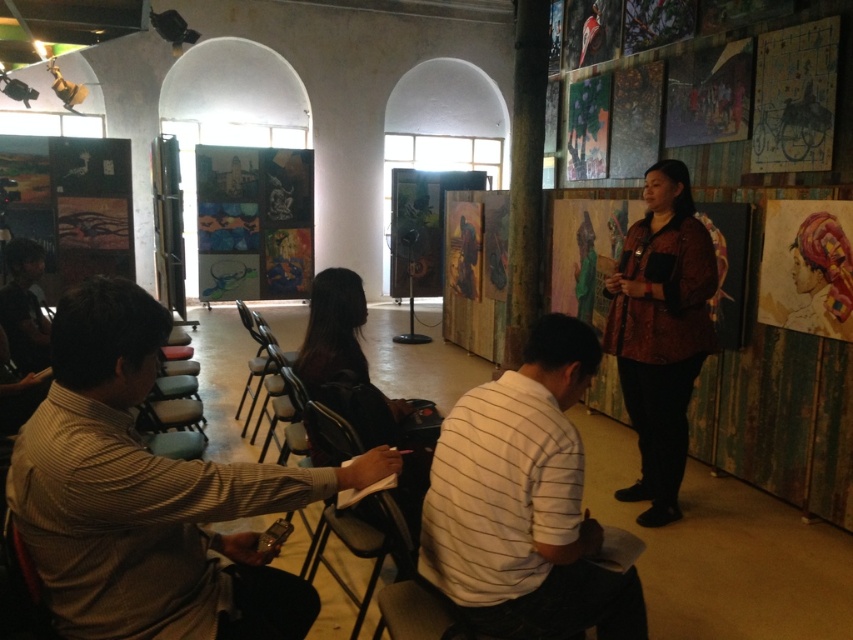
Question: Among these points, which one is farthest from the camera?

Choices:
 (A) (527, 424)
 (B) (236, 481)

Answer: (A)

Question: In this image, where is light brown striped shirt at lower left located relative to printed silk blouse at center?

Choices:
 (A) above
 (B) below

Answer: (B)

Question: Does light brown striped shirt at lower left lie behind printed silk blouse at center?

Choices:
 (A) no
 (B) yes

Answer: (A)

Question: Can you confirm if white striped shirt at center is positioned to the right of printed silk blouse at center?

Choices:
 (A) no
 (B) yes

Answer: (A)

Question: Which of the following is the farthest from the observer?

Choices:
 (A) (77, 604)
 (B) (682, 209)

Answer: (B)

Question: Among these objects, which one is farthest from the camera?

Choices:
 (A) white striped shirt at center
 (B) printed silk blouse at center
 (C) light brown striped shirt at lower left

Answer: (B)